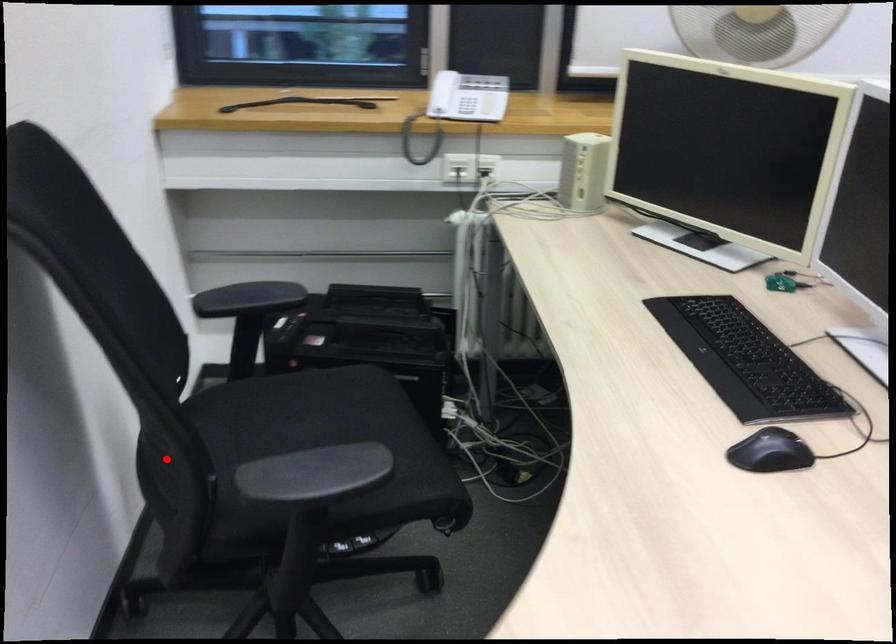
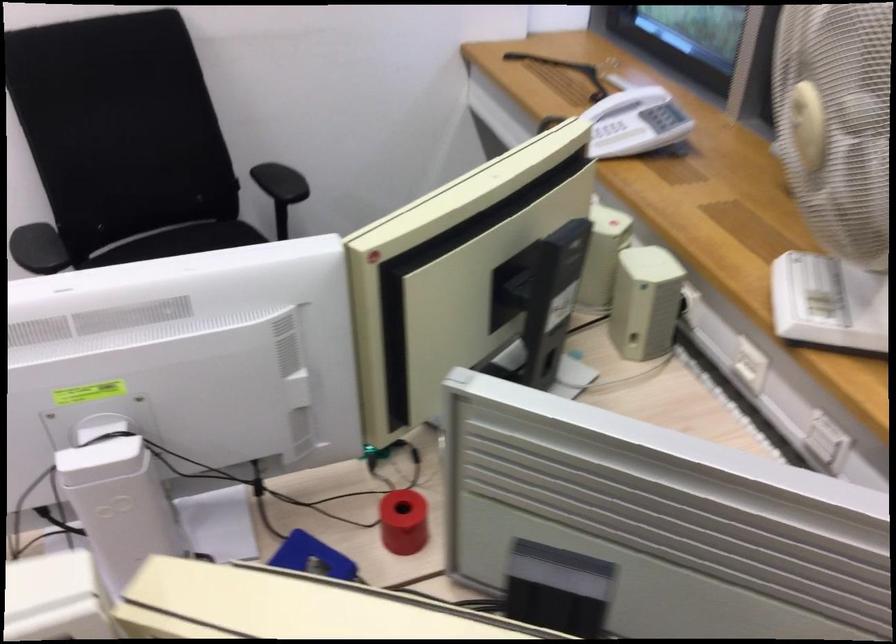
Question: I am providing you with two images of the same scene from different viewpoints. In image1, a red point is highlighted. Considering the same 3D point in image2, which of the following is correct?

Choices:
 (A) It is closer
 (B) It is farther

Answer: (B)